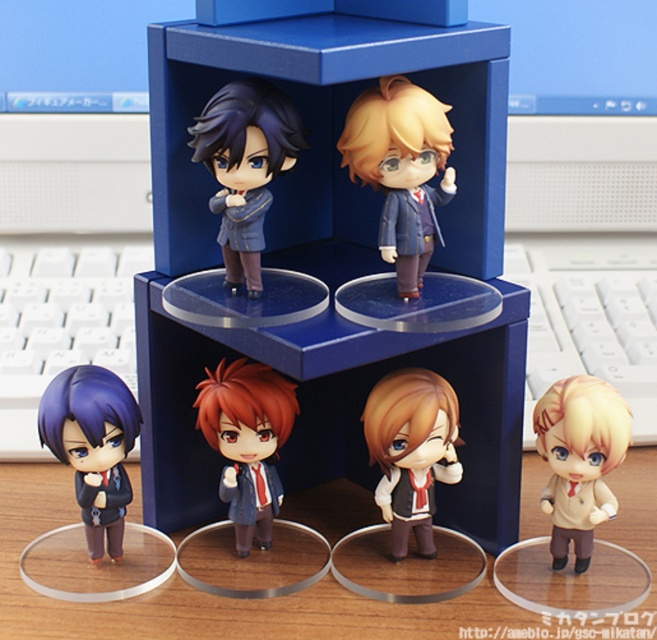
Question: Which object appears farthest from the camera in this image?

Choices:
 (A) light brown matte figure at lower right
 (B) matte black suit at lower left
 (C) white plastic keyboard at upper center
 (D) matte black figurine at lower left

Answer: (C)

Question: Among these points, which one is farthest from the camera?

Choices:
 (A) (269, 166)
 (B) (11, 256)

Answer: (B)

Question: Is matte brown vest at center positioned in front of light brown matte figure at lower right?

Choices:
 (A) yes
 (B) no

Answer: (B)

Question: Can you confirm if matte black figurine at lower left is positioned above light brown matte figure at lower right?

Choices:
 (A) no
 (B) yes

Answer: (B)

Question: Which object is farther from the camera taking this photo?

Choices:
 (A) blue plastic box at center
 (B) matte brown vest at center

Answer: (B)

Question: Does white plastic keyboard at upper center appear under light brown matte figure at lower right?

Choices:
 (A) yes
 (B) no

Answer: (B)